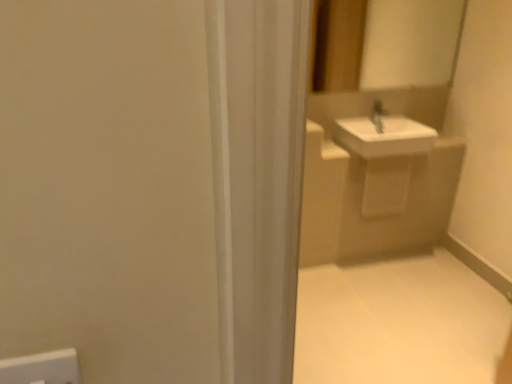
Question: Is white glossy sink at upper right in contact with white tile floor at lower right?

Choices:
 (A) no
 (B) yes

Answer: (A)

Question: Is white glossy sink at upper right bigger than white tile floor at lower right?

Choices:
 (A) no
 (B) yes

Answer: (B)

Question: Is white glossy sink at upper right wider than white tile floor at lower right?

Choices:
 (A) yes
 (B) no

Answer: (B)

Question: Can you confirm if white glossy sink at upper right is thinner than white tile floor at lower right?

Choices:
 (A) yes
 (B) no

Answer: (A)

Question: Does white glossy sink at upper right lie behind white tile floor at lower right?

Choices:
 (A) no
 (B) yes

Answer: (B)

Question: In terms of height, does white glossy sink at upper right look taller or shorter compared to white glossy mirror at upper center?

Choices:
 (A) short
 (B) tall

Answer: (A)

Question: In the image, is white glossy sink at upper right positioned in front of or behind white glossy mirror at upper center?

Choices:
 (A) front
 (B) behind

Answer: (B)

Question: In terms of width, does white glossy sink at upper right look wider or thinner when compared to white glossy mirror at upper center?

Choices:
 (A) wide
 (B) thin

Answer: (A)

Question: Is point (399, 145) positioned closer to the camera than point (365, 64)?

Choices:
 (A) closer
 (B) farther

Answer: (A)

Question: From their relative heights in the image, would you say white tile floor at lower right is taller or shorter than white glossy mirror at upper center?

Choices:
 (A) tall
 (B) short

Answer: (B)

Question: From a real-world perspective, is white tile floor at lower right positioned above or below white glossy mirror at upper center?

Choices:
 (A) below
 (B) above

Answer: (A)

Question: From the image's perspective, is white tile floor at lower right above or below white glossy mirror at upper center?

Choices:
 (A) above
 (B) below

Answer: (B)

Question: Relative to white glossy mirror at upper center, is white tile floor at lower right in front or behind?

Choices:
 (A) front
 (B) behind

Answer: (A)

Question: From the image's perspective, is white tile floor at lower right above or below white glossy sink at upper right?

Choices:
 (A) above
 (B) below

Answer: (B)

Question: Do you think white tile floor at lower right is within white glossy sink at upper right, or outside of it?

Choices:
 (A) outside
 (B) inside

Answer: (A)